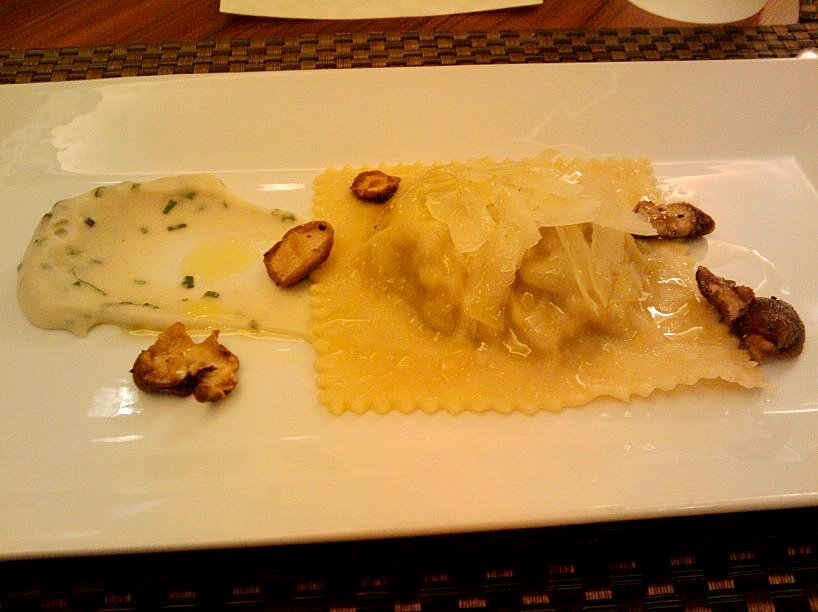
The image size is (818, 612). Find the location of `lower portion of bronze woven placement in deep shadow`. lower portion of bronze woven placement in deep shadow is located at coordinates (434, 581).